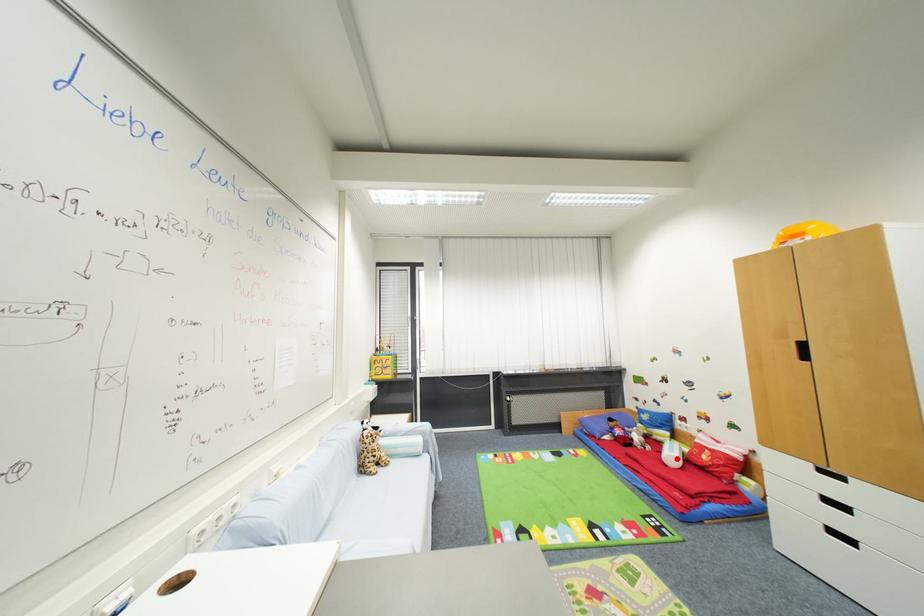
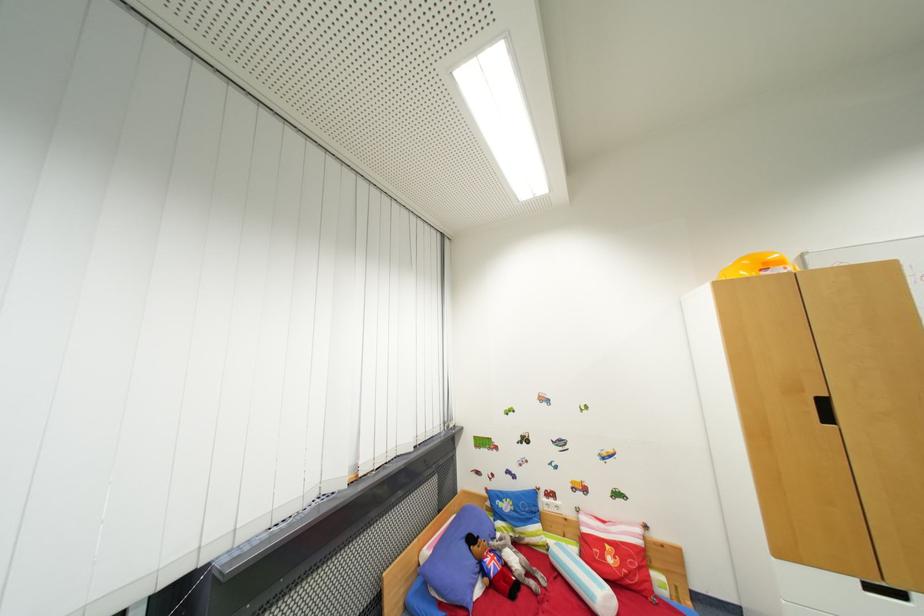
Question: I am providing you with two images of the same scene from different viewpoints. Given a red point in image1, look at the same physical point in image2. Is it:

Choices:
 (A) Closer to the viewpoint
 (B) Farther from the viewpoint

Answer: (B)